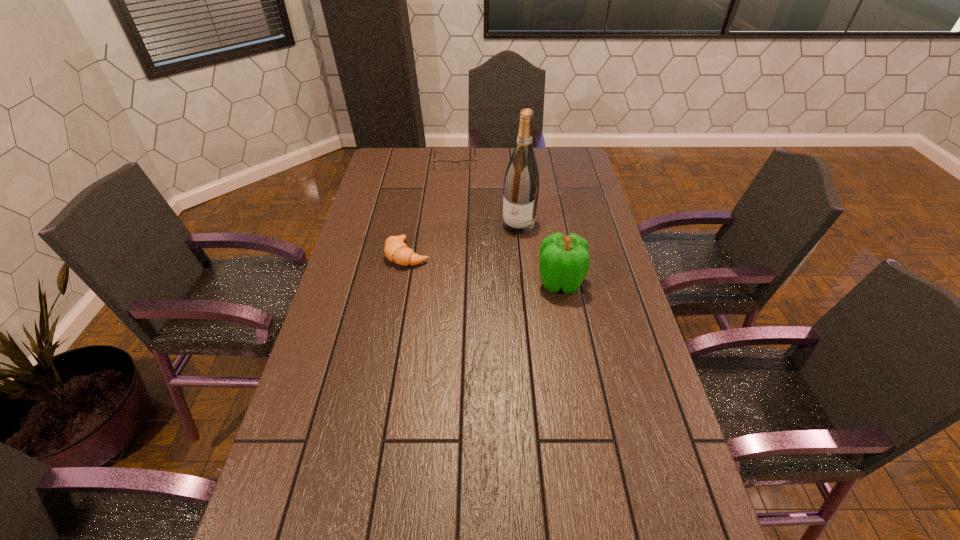
Identify the location of vacant space located on the label of the second farthest object. (499, 260).

Where is `vacant region located 0.230m on the front-facing side of the farthest object`? The width and height of the screenshot is (960, 540). vacant region located 0.230m on the front-facing side of the farthest object is located at coordinates coord(458,202).

Identify the location of free location located on the front-facing side of the farthest object. The width and height of the screenshot is (960, 540). (460, 224).

This screenshot has height=540, width=960. I want to click on vacant space situated 0.200m on the front-facing side of the farthest object, so click(x=458, y=197).

The height and width of the screenshot is (540, 960). Identify the location of object present at the far edge. (465, 164).

You are a GUI agent. You are given a task and a screenshot of the screen. Output one action in this format:
    pyautogui.click(x=<x>, y=<y>)
    Task: Click on the object positioned at the left edge
    
    Given the screenshot: What is the action you would take?
    pyautogui.click(x=396, y=251)

The width and height of the screenshot is (960, 540). In order to click on object present at the right edge in this screenshot , I will do `click(564, 262)`.

Where is `free space at the far edge of the desktop`? free space at the far edge of the desktop is located at coordinates (x=540, y=156).

Where is `free space at the near edge of the desktop`? This screenshot has width=960, height=540. free space at the near edge of the desktop is located at coordinates (616, 502).

You are a GUI agent. You are given a task and a screenshot of the screen. Output one action in this format:
    pyautogui.click(x=<x>, y=<y>)
    Task: Click on the vacant region at the left edge
    
    Given the screenshot: What is the action you would take?
    click(408, 179)